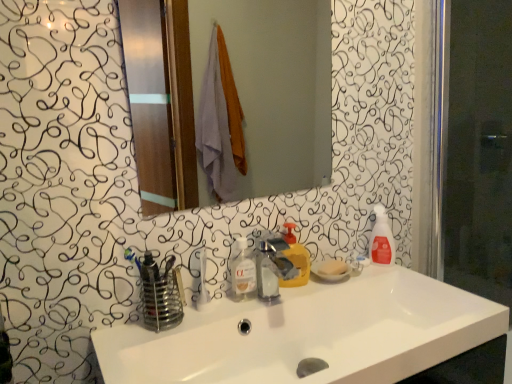
I want to click on vacant area that lies between metallic silver faucet at center and yellow liquid soap at center, marked as the first cleaning product in a left-to-right arrangement, so click(290, 293).